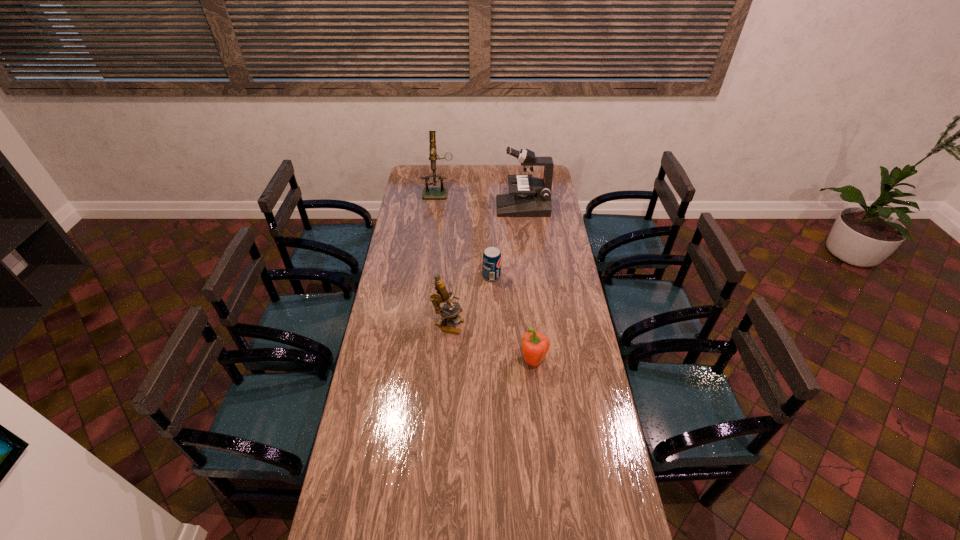
The height and width of the screenshot is (540, 960). In order to click on the rightmost microscope in this screenshot , I will do `click(532, 196)`.

This screenshot has height=540, width=960. I want to click on the third shortest object, so click(442, 296).

Locate an element on the screen. The width and height of the screenshot is (960, 540). the nearest microscope is located at coordinates (442, 296).

Where is `the fourth tallest object`? This screenshot has width=960, height=540. the fourth tallest object is located at coordinates (535, 346).

The width and height of the screenshot is (960, 540). In order to click on pepper in this screenshot , I will do `click(535, 346)`.

Where is `the third farthest object`? The width and height of the screenshot is (960, 540). the third farthest object is located at coordinates (491, 257).

You are a GUI agent. You are given a task and a screenshot of the screen. Output one action in this format:
    pyautogui.click(x=<x>, y=<y>)
    Task: Click on the shortest object
    
    Given the screenshot: What is the action you would take?
    pyautogui.click(x=491, y=257)

Find the location of a particular element. This screenshot has width=960, height=540. vacant area located 0.230m through the eyepieces of the rightmost microscope is located at coordinates (455, 207).

At what (x,y) coordinates should I click in order to perform the action: click on free region located through the eyepieces of the rightmost microscope. Please return your answer as a coordinate pair (x, y). The width and height of the screenshot is (960, 540). Looking at the image, I should click on (443, 207).

The image size is (960, 540). I want to click on vacant space located through the eyepieces of the rightmost microscope, so click(439, 207).